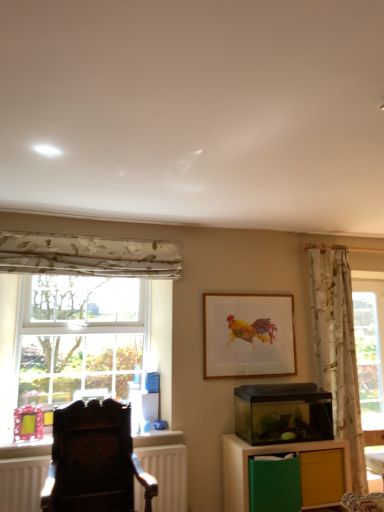
Question: Considering the relative sizes of wooden frame at center and floral fabric curtain at left, which ranks as the first curtain in left-to-right order, in the image provided, is wooden frame at center shorter than floral fabric curtain at left, which ranks as the first curtain in left-to-right order,?

Choices:
 (A) yes
 (B) no

Answer: (B)

Question: Is wooden frame at center outside floral fabric curtain at left, which ranks as the second curtain in bottom-to-top order?

Choices:
 (A) yes
 (B) no

Answer: (A)

Question: Is wooden frame at center oriented towards floral fabric curtain at left, which appears as the 2th curtain when viewed from the right?

Choices:
 (A) yes
 (B) no

Answer: (B)

Question: Considering the relative positions of wooden frame at center and floral fabric curtain at left, which appears as the 2th curtain when viewed from the right, in the image provided, is wooden frame at center to the right of floral fabric curtain at left, which appears as the 2th curtain when viewed from the right, from the viewer's perspective?

Choices:
 (A) no
 (B) yes

Answer: (B)

Question: From the image's perspective, is wooden frame at center on floral fabric curtain at left, which ranks as the second curtain in bottom-to-top order?

Choices:
 (A) no
 (B) yes

Answer: (A)

Question: From the image's perspective, is white matte radiator at lower left positioned above or below transparent glass aquarium at center-right?

Choices:
 (A) below
 (B) above

Answer: (A)

Question: Do you think white matte radiator at lower left is within transparent glass aquarium at center-right, or outside of it?

Choices:
 (A) outside
 (B) inside

Answer: (A)

Question: Looking at their shapes, would you say white matte radiator at lower left is wider or thinner than transparent glass aquarium at center-right?

Choices:
 (A) wide
 (B) thin

Answer: (B)

Question: From a real-world perspective, is white matte radiator at lower left above or below transparent glass aquarium at center-right?

Choices:
 (A) below
 (B) above

Answer: (A)

Question: In terms of size, does matte yellow drawer at lower right appear bigger or smaller than transparent glass aquarium at center-right?

Choices:
 (A) small
 (B) big

Answer: (A)

Question: In terms of width, does matte yellow drawer at lower right look wider or thinner when compared to transparent glass aquarium at center-right?

Choices:
 (A) wide
 (B) thin

Answer: (B)

Question: From a real-world perspective, relative to transparent glass aquarium at center-right, is matte yellow drawer at lower right vertically above or below?

Choices:
 (A) below
 (B) above

Answer: (A)

Question: From the image's perspective, is matte yellow drawer at lower right above or below transparent glass aquarium at center-right?

Choices:
 (A) above
 (B) below

Answer: (B)

Question: From the image's perspective, is dark wood chair at left above or below clear glass window at left?

Choices:
 (A) above
 (B) below

Answer: (B)

Question: In the image, is dark wood chair at left positioned in front of or behind clear glass window at left?

Choices:
 (A) behind
 (B) front

Answer: (B)